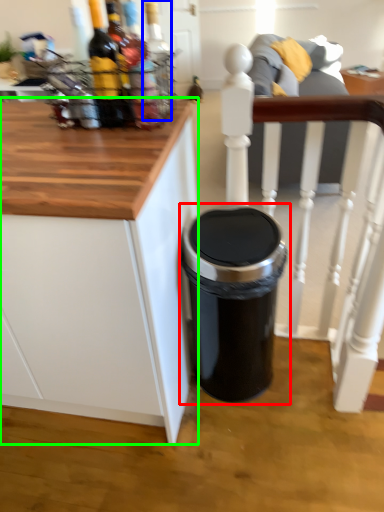
Question: Based on their relative distances, which object is nearer to waste container (highlighted by a red box)? Choose from bottle (highlighted by a blue box) and cabinetry (highlighted by a green box).

Choices:
 (A) bottle
 (B) cabinetry

Answer: (B)